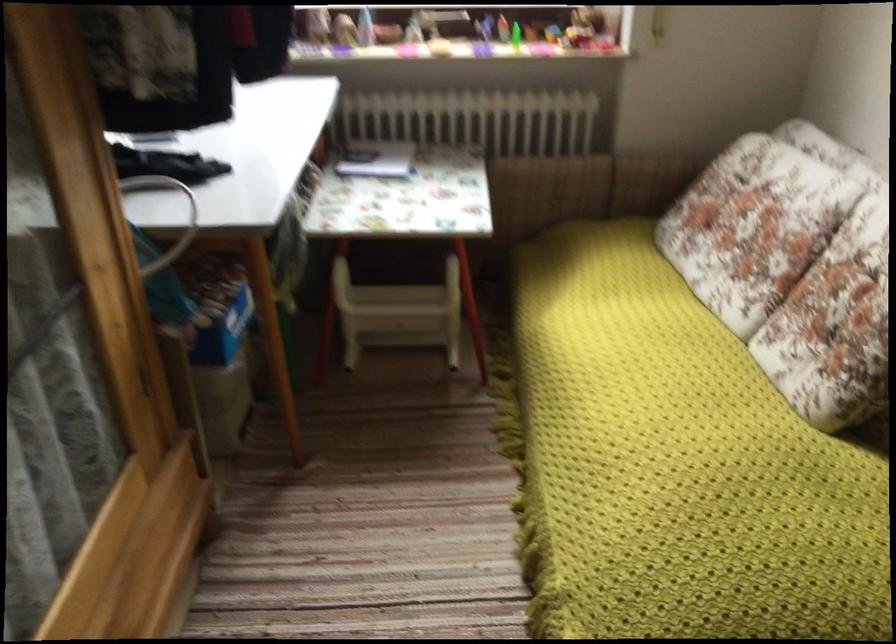
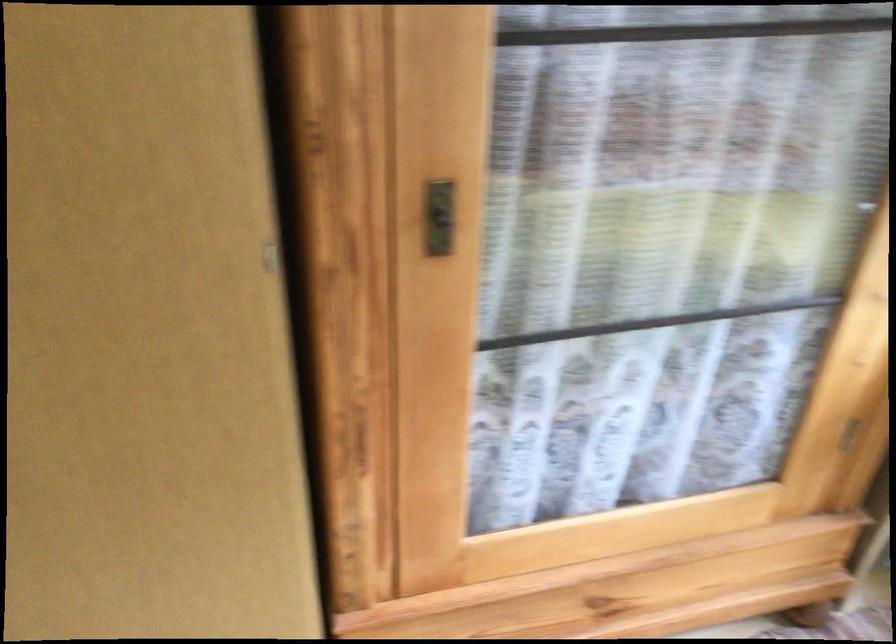
The first image is from the beginning of the video and the second image is from the end. How did the camera likely rotate when shooting the video?

The camera rotated toward left-down.